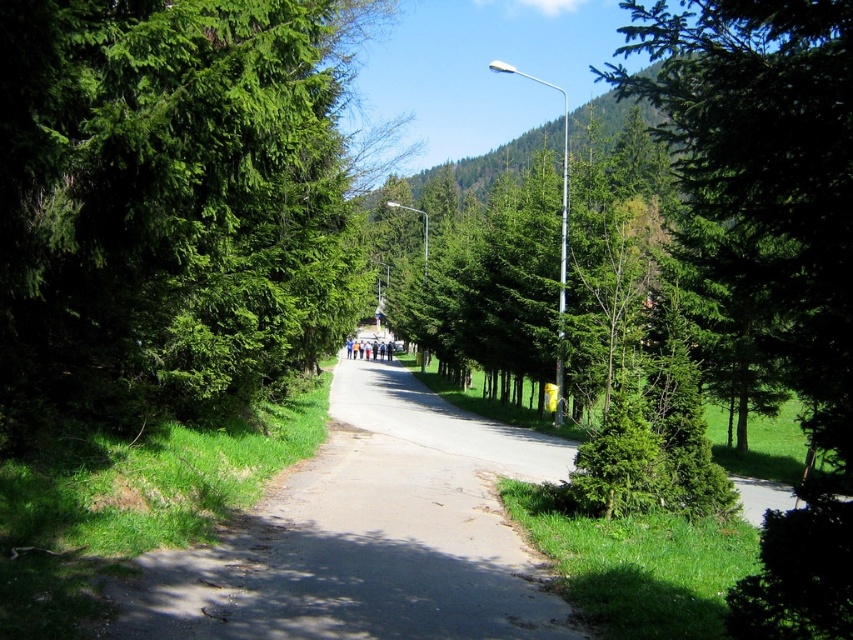
Is green leafy tree at center thinner than green glossy tree at right?

Correct, green leafy tree at center's width is less than green glossy tree at right's.

Which is behind, point (260, 44) or point (790, 58)?

The point (260, 44) is more distant.

Is point (326, 192) more distant than point (814, 40)?

That is True.

The height and width of the screenshot is (640, 853). Identify the location of green leafy tree at center. (170, 202).

Does green leafy tree at center appear under smooth asphalt road at center?

Actually, green leafy tree at center is above smooth asphalt road at center.

Does green leafy tree at center appear on the right side of smooth asphalt road at center?

Incorrect, green leafy tree at center is not on the right side of smooth asphalt road at center.

Between point (155, 42) and point (408, 444), which one is positioned in front?

Point (155, 42) is more forward.

Find the location of a particular element. This screenshot has width=853, height=640. green leafy tree at center is located at coordinates (170, 202).

Between smooth asphalt road at center and green glossy tree at right, which one has more height?

green glossy tree at right is taller.

Can you confirm if smooth asphalt road at center is thinner than green glossy tree at right?

Indeed, smooth asphalt road at center has a lesser width compared to green glossy tree at right.

This screenshot has width=853, height=640. Describe the element at coordinates (368, 536) in the screenshot. I see `smooth asphalt road at center` at that location.

The height and width of the screenshot is (640, 853). In order to click on smooth asphalt road at center in this screenshot , I will do `click(368, 536)`.